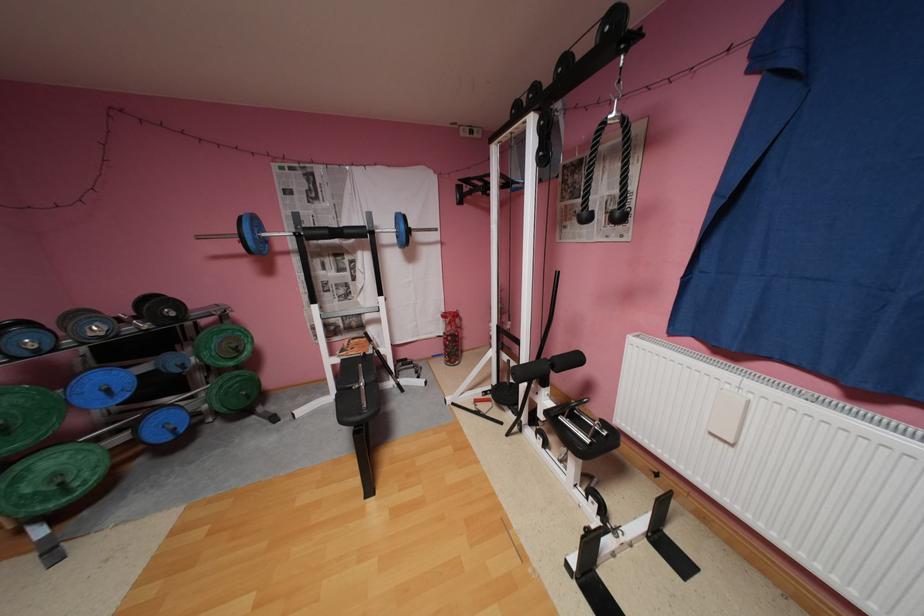
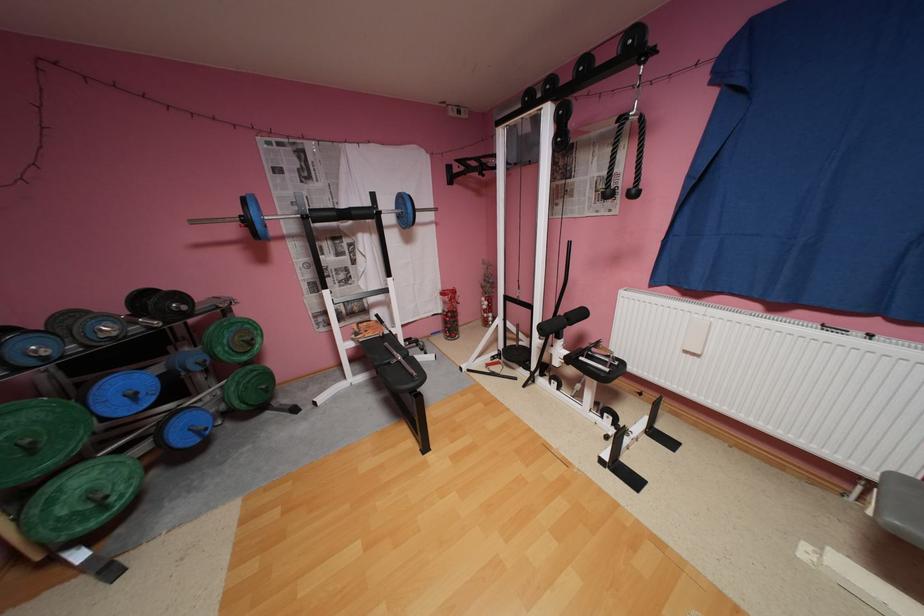
In the second image, find the point that corresponds to [208,237] in the first image.

(202, 223)